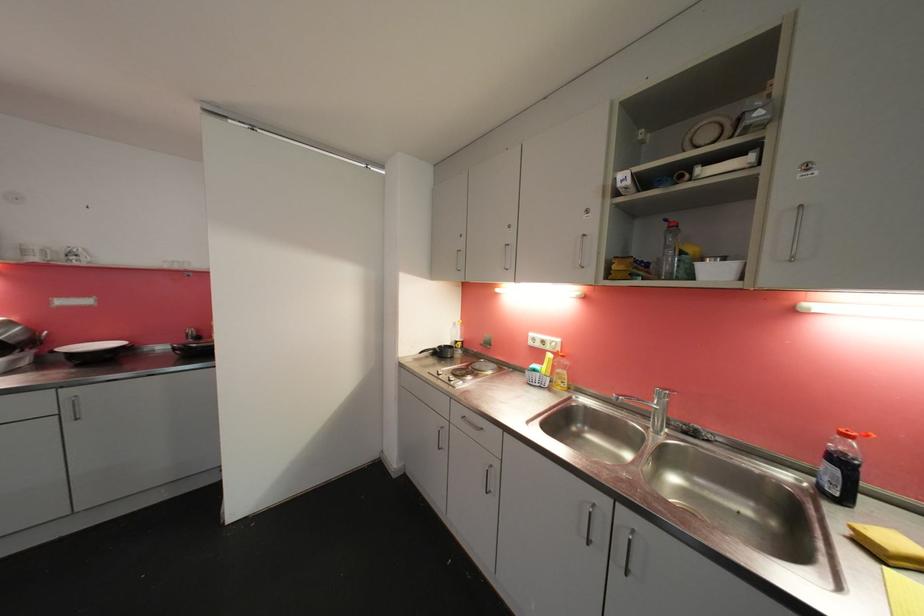
This screenshot has height=616, width=924. Describe the element at coordinates (670, 249) in the screenshot. I see `the clear plastic bottle` at that location.